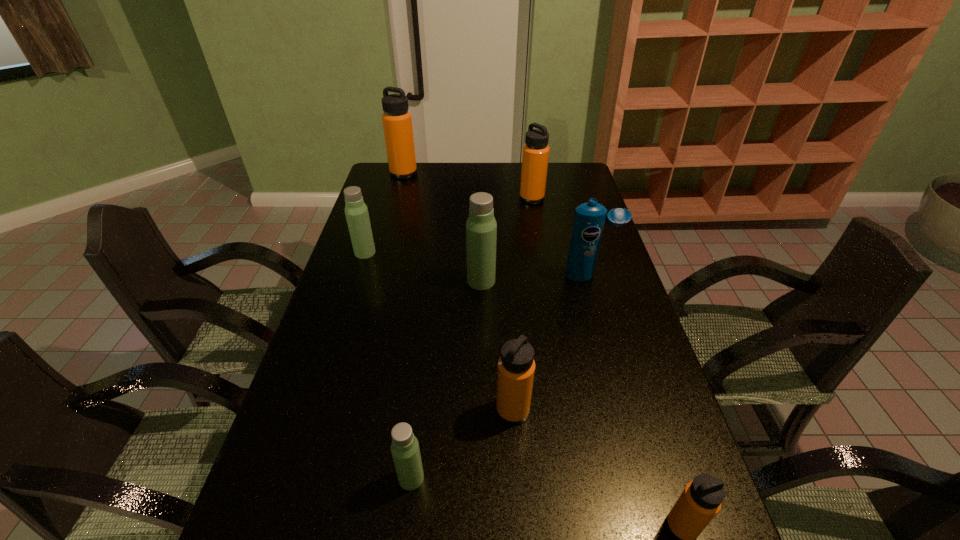
Identify the location of the third nearest object. The height and width of the screenshot is (540, 960). (516, 367).

Where is `the smallest light thermos bottle`? This screenshot has height=540, width=960. the smallest light thermos bottle is located at coordinates (405, 450).

Image resolution: width=960 pixels, height=540 pixels. In order to click on the fifth thermos bottle from right to left in this screenshot , I will do `click(405, 450)`.

This screenshot has height=540, width=960. What are the coordinates of `vacant space located 0.350m on the right of the tallest thermos bottle` in the screenshot? It's located at 498,173.

The image size is (960, 540). What are the coordinates of `vacant region located on the front of the biggest light thermos bottle` in the screenshot? It's located at (482, 380).

Find the location of a particular element. The height and width of the screenshot is (540, 960). vacant space located on the front of the second farthest thermos bottle is located at coordinates (535, 213).

Where is `free space located 0.370m on the left of the shampoo`? free space located 0.370m on the left of the shampoo is located at coordinates (448, 276).

Locate an element on the screen. free spot located 0.250m on the front of the third farthest object is located at coordinates (346, 313).

This screenshot has height=540, width=960. What are the coordinates of `free space located 0.360m on the back of the third nearest thermos bottle` in the screenshot? It's located at (506, 294).

Where is `vacant area situated on the right of the smallest light thermos bottle`? The height and width of the screenshot is (540, 960). vacant area situated on the right of the smallest light thermos bottle is located at coordinates (453, 478).